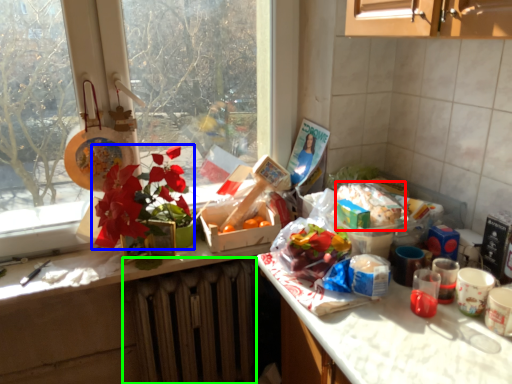
Question: Estimate the real-world distances between objects in this image. Which object is closer to food (highlighted by a red box), flower (highlighted by a blue box) or radiator (highlighted by a green box)?

Choices:
 (A) flower
 (B) radiator

Answer: (A)